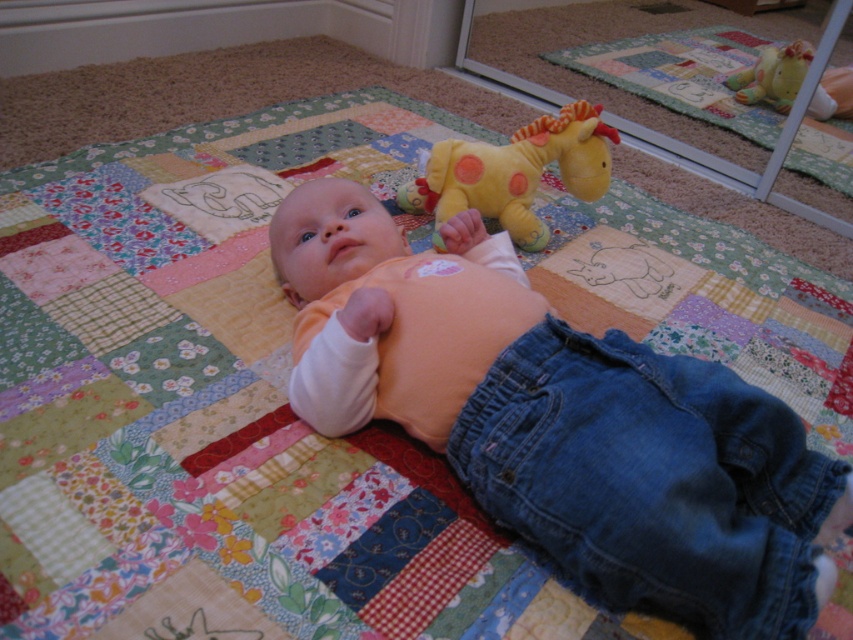
You are a photographer taking a picture of the baby and the objects in the scene. Based on their positions, which object is closer to the camera between the matte orange shirt at center and the yellow plush giraffe at upper center?

The yellow plush giraffe at upper center is closer to the camera because it is positioned above the matte orange shirt at center, which is located below it.

You are a photographer trying to capture the baby in the image. You need to place a small prop exactly where the matte orange shirt at center is located. What are the coordinates where you should place the prop?

The coordinates for the matte orange shirt at center are point [561,419]. Place the prop there.